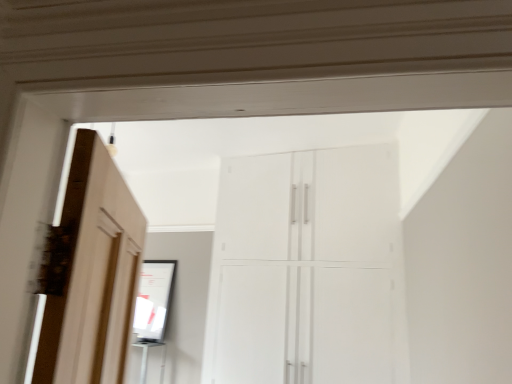
Question: From a real-world perspective, does white glossy cupboard at center stand above matte black mirror at center?

Choices:
 (A) yes
 (B) no

Answer: (A)

Question: Is white glossy cupboard at center facing towards matte black mirror at center?

Choices:
 (A) yes
 (B) no

Answer: (B)

Question: Considering the relative positions of white glossy cupboard at center and matte black mirror at center in the image provided, is white glossy cupboard at center in front of matte black mirror at center?

Choices:
 (A) yes
 (B) no

Answer: (A)

Question: Is white glossy cupboard at center not close to matte black mirror at center?

Choices:
 (A) yes
 (B) no

Answer: (A)

Question: Can you see white glossy cupboard at center touching matte black mirror at center?

Choices:
 (A) yes
 (B) no

Answer: (B)

Question: Does white glossy cupboard at center have a lesser height compared to matte black mirror at center?

Choices:
 (A) no
 (B) yes

Answer: (A)

Question: Is the position of matte black mirror at center more distant than that of white glossy cupboard at center?

Choices:
 (A) no
 (B) yes

Answer: (B)

Question: From a real-world perspective, is matte black mirror at center located higher than white glossy cupboard at center?

Choices:
 (A) yes
 (B) no

Answer: (B)

Question: Could you tell me if matte black mirror at center is facing white glossy cupboard at center?

Choices:
 (A) no
 (B) yes

Answer: (A)

Question: From a real-world perspective, is matte black mirror at center positioned under white glossy cupboard at center based on gravity?

Choices:
 (A) yes
 (B) no

Answer: (A)

Question: From the image's perspective, would you say matte black mirror at center is shown under white glossy cupboard at center?

Choices:
 (A) yes
 (B) no

Answer: (A)

Question: From the image's perspective, does matte black mirror at center appear higher than white glossy cupboard at center?

Choices:
 (A) yes
 (B) no

Answer: (B)

Question: Is point (374, 155) positioned closer to the camera than point (154, 337)?

Choices:
 (A) farther
 (B) closer

Answer: (B)